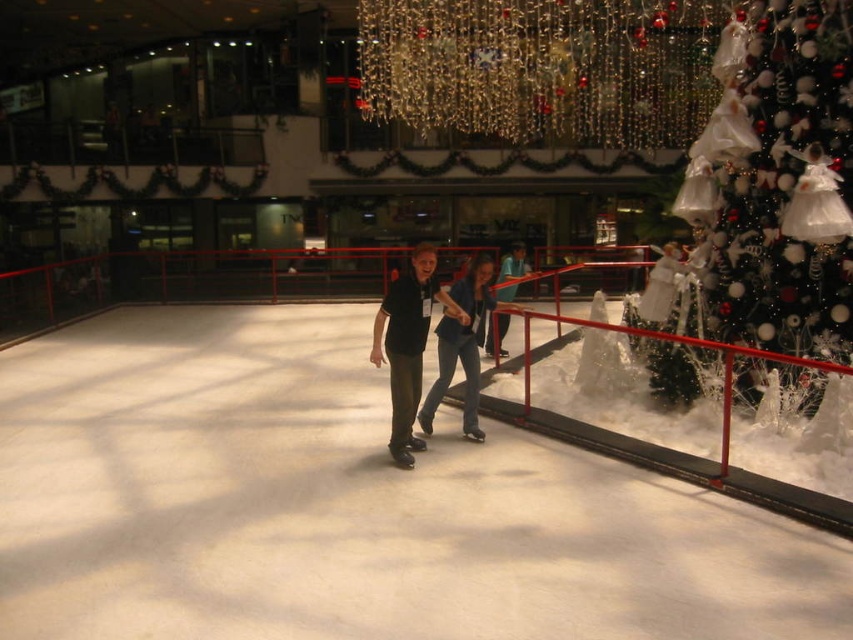
Question: Can you confirm if white smooth ice at center is smaller than shiny green tree at right?

Choices:
 (A) no
 (B) yes

Answer: (A)

Question: Is white smooth ice at center to the right of matte black skates at center from the viewer's perspective?

Choices:
 (A) yes
 (B) no

Answer: (B)

Question: Which of the following is the closest to the observer?

Choices:
 (A) (819, 106)
 (B) (471, 300)
 (C) (485, 260)
 (D) (323, 636)

Answer: (D)

Question: Is shiny green tree at right bigger than denim jacket at center?

Choices:
 (A) yes
 (B) no

Answer: (A)

Question: Which object appears farthest from the camera in this image?

Choices:
 (A) shiny green tree at right
 (B) denim jacket at center
 (C) matte black skates at center

Answer: (A)

Question: Which point is farther to the camera?

Choices:
 (A) (466, 312)
 (B) (339, 385)
 (C) (756, 20)
 (D) (403, 400)

Answer: (B)